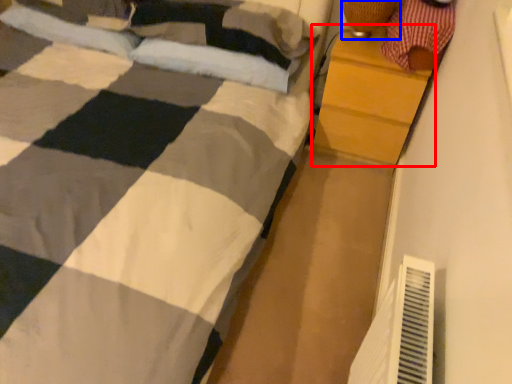
Question: Which of the following is the closest to the observer, chest of drawers (highlighted by a red box) or lamp (highlighted by a blue box)?

Choices:
 (A) chest of drawers
 (B) lamp

Answer: (B)